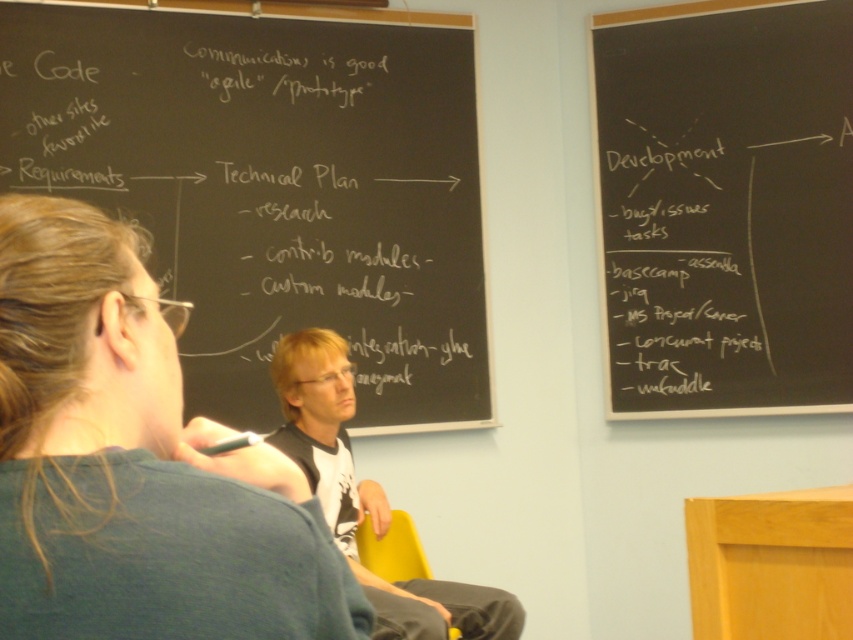
Question: Which point is closer to the camera?

Choices:
 (A) (x=444, y=202)
 (B) (x=360, y=547)
 (C) (x=250, y=570)

Answer: (C)

Question: Is light brown hair at center to the left of yellow plastic chair at lower center from the viewer's perspective?

Choices:
 (A) no
 (B) yes

Answer: (B)

Question: Can you confirm if light brown hair at center is positioned below yellow plastic chair at lower center?

Choices:
 (A) yes
 (B) no

Answer: (B)

Question: From the image, what is the correct spatial relationship of black chalkboard at upper left in relation to yellow plastic chair at lower center?

Choices:
 (A) above
 (B) below

Answer: (A)

Question: Which of the following is the closest to the observer?

Choices:
 (A) (804, 152)
 (B) (341, 348)
 (C) (144, 595)
 (D) (387, 572)

Answer: (C)

Question: Which of the following is the closest to the observer?

Choices:
 (A) (374, 532)
 (B) (281, 518)
 (C) (225, 304)

Answer: (B)